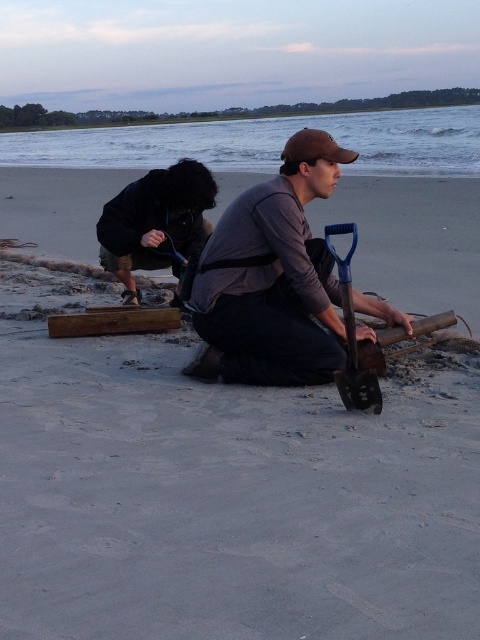
Looking at this image, you are standing at the origin point in the image. Where is the smooth sand shovel at center located in terms of coordinates?

The smooth sand shovel at center is located at coordinates point (x=229, y=499).

You are a photographer trying to capture a clear shot of the brown wood at lower center. However, the black fabric bag at left is blocking your view. Can you move the bag to the side to get an unobstructed view?

The black fabric bag at left is above the brown wood at lower center, so moving the bag downward would allow you to see the brown wood at lower center without obstruction.

You are a photographer standing at the center of the beach scene. You want to place a new tripod exactly 0.5 meters to the right of the black fabric bag at left. What are the coordinates of the new tripod location?

The coordinates of the new tripod location would be approximately at point 0.348 plus 0.5 meters in the x direction, but since the original coordinate system isn